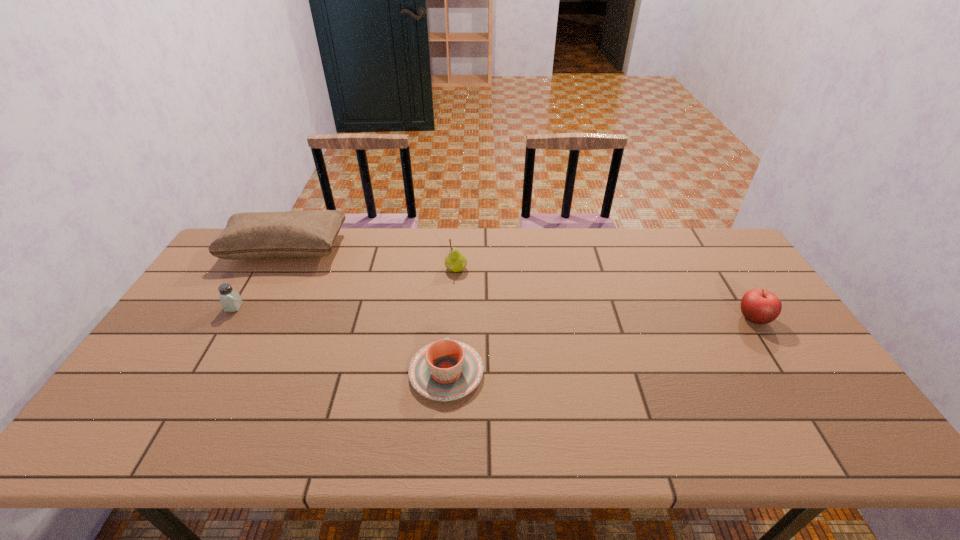
In the image, there is a desktop. Find the location of `free space at the near edge`. free space at the near edge is located at coordinates (781, 448).

This screenshot has width=960, height=540. Identify the location of vacant space at the right edge of the desktop. (722, 300).

The width and height of the screenshot is (960, 540). In order to click on vacant space at the near right corner of the desktop in this screenshot , I will do `click(798, 420)`.

At what (x,y) coordinates should I click in order to perform the action: click on free space between the pear and the saltshaker. Please return your answer as a coordinate pair (x, y). Looking at the image, I should click on (346, 288).

You are a GUI agent. You are given a task and a screenshot of the screen. Output one action in this format:
    pyautogui.click(x=<x>, y=<y>)
    Task: Click on the free point between the apple and the pear
    The height and width of the screenshot is (540, 960).
    Given the screenshot: What is the action you would take?
    pyautogui.click(x=605, y=294)

Find the location of a particular element. This screenshot has height=540, width=960. blank region between the pear and the rightmost object is located at coordinates (605, 294).

The image size is (960, 540). Find the location of `free space between the cushion and the saltshaker`. free space between the cushion and the saltshaker is located at coordinates (260, 278).

This screenshot has width=960, height=540. Find the location of `vacant point located between the nearest object and the pear`. vacant point located between the nearest object and the pear is located at coordinates (451, 321).

Where is `free space that is in between the cushion and the rightmost object`? The height and width of the screenshot is (540, 960). free space that is in between the cushion and the rightmost object is located at coordinates (519, 284).

The height and width of the screenshot is (540, 960). What are the coordinates of `empty space between the cushion and the saltshaker` in the screenshot? It's located at tap(260, 278).